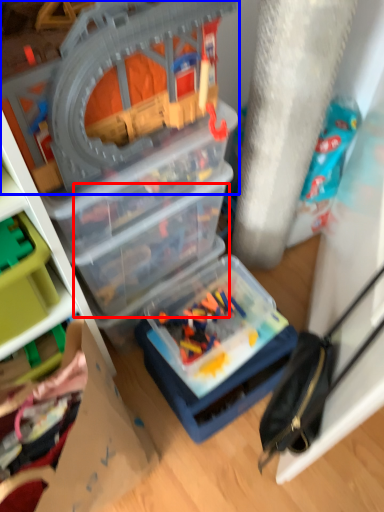
Question: Which object appears farthest to the camera in this image, box (highlighted by a red box) or toy (highlighted by a blue box)?

Choices:
 (A) box
 (B) toy

Answer: (A)